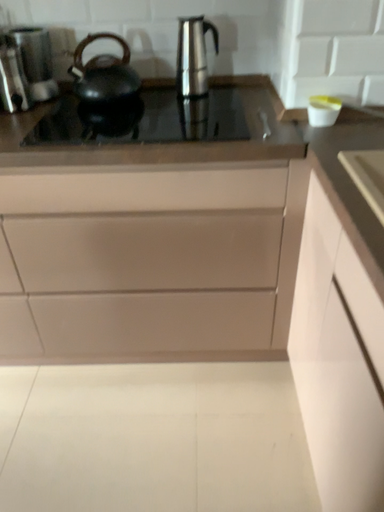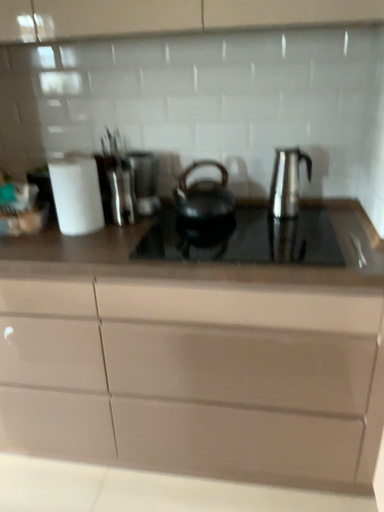
Question: How did the camera likely rotate when shooting the video?

Choices:
 (A) rotated left
 (B) rotated right

Answer: (A)